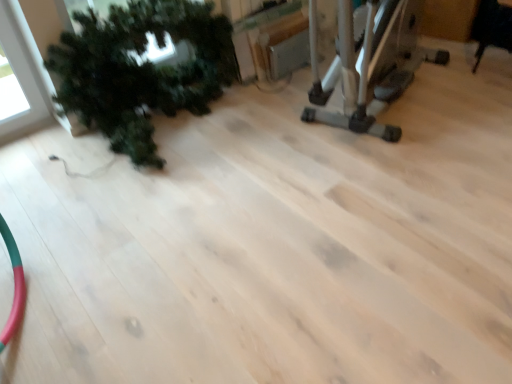
What are the coordinates of `vacant area that is in front of green matte plant at left` in the screenshot? It's located at (106, 226).